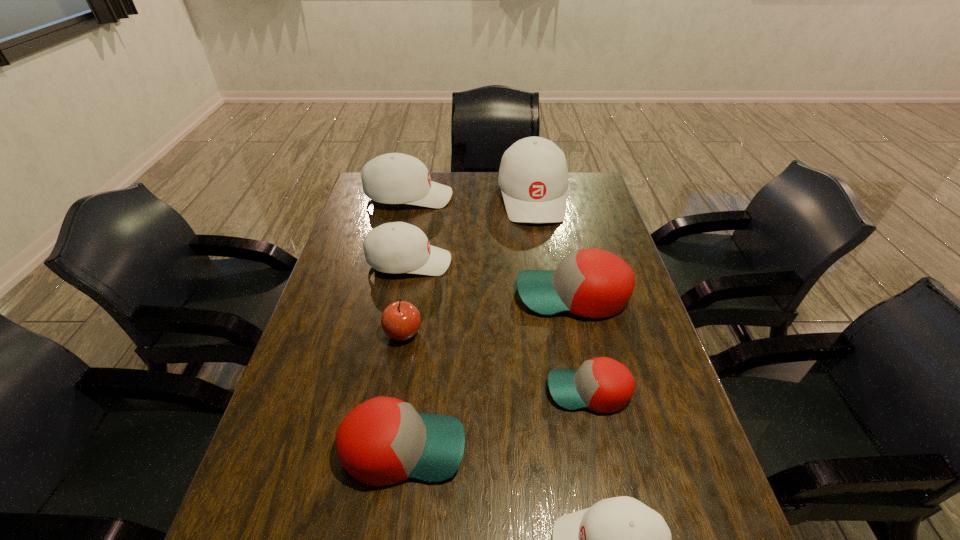
Locate an element on the screen. This screenshot has height=540, width=960. vacant space positioned 0.160m on the front-facing side of the tallest object is located at coordinates (542, 258).

Identify the location of free space located on the front-facing side of the third smallest white baseball cap. Image resolution: width=960 pixels, height=540 pixels. (x=476, y=197).

The image size is (960, 540). Find the location of `free location located 0.060m at the brim of the biggest red baseball cap`. free location located 0.060m at the brim of the biggest red baseball cap is located at coordinates (494, 295).

The height and width of the screenshot is (540, 960). Find the location of `free region located at the brim of the biggest red baseball cap`. free region located at the brim of the biggest red baseball cap is located at coordinates (419, 295).

Identify the location of vacant space located 0.390m at the brim of the biggest red baseball cap. This screenshot has height=540, width=960. (380, 295).

Where is `free space located 0.370m on the front-facing side of the second smallest white baseball cap`? free space located 0.370m on the front-facing side of the second smallest white baseball cap is located at coordinates (569, 262).

The image size is (960, 540). I want to click on vacant point located on the right of the apple, so click(453, 333).

Find the location of `vacant space located 0.150m at the brim of the second smallest red baseball cap`. vacant space located 0.150m at the brim of the second smallest red baseball cap is located at coordinates (537, 448).

Where is `free space located at the brim of the shortest baseball cap`? The image size is (960, 540). free space located at the brim of the shortest baseball cap is located at coordinates (470, 391).

The image size is (960, 540). In order to click on free space located at the brim of the shortest baseball cap in this screenshot , I will do `click(508, 391)`.